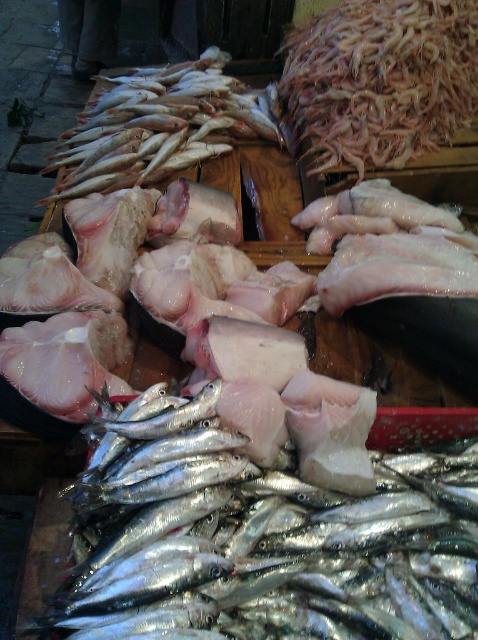
You are a GUI agent. You are given a task and a screenshot of the screen. Output one action in this format:
    pyautogui.click(x=<x>, y=<y>)
    Task: Click on the pinkish-white shrimp at upper center
    
    Given the screenshot: What is the action you would take?
    pyautogui.click(x=380, y=81)

Does pinkish-white shrimp at upper center appear over shiny silver fish at upper left?

Indeed, pinkish-white shrimp at upper center is positioned over shiny silver fish at upper left.

Where is `pinkish-white shrimp at upper center`? The height and width of the screenshot is (640, 478). pinkish-white shrimp at upper center is located at coordinates (380, 81).

Measure the distance from shiny silver fish at center to shiny silver fish at upper left.

shiny silver fish at center and shiny silver fish at upper left are 1.40 meters apart.

Is point (430, 612) positioned behind point (223, 122)?

No, it is in front of (223, 122).

At what (x,y) coordinates should I click in order to perform the action: click on shiny silver fish at center. Please return your answer as a coordinate pair (x, y). Looking at the image, I should click on (262, 541).

Is shiny silver fish at center positioned in front of pinkish-white shrimp at upper center?

Yes, it is.

The height and width of the screenshot is (640, 478). In order to click on shiny silver fish at center in this screenshot , I will do `click(262, 541)`.